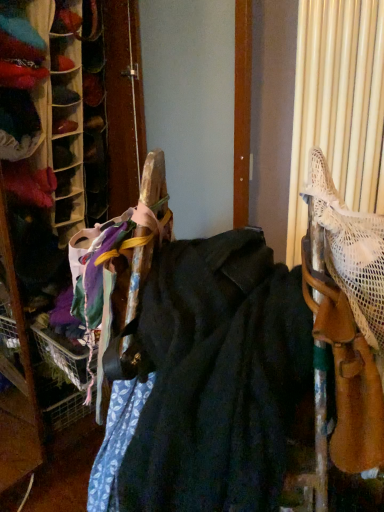
Find the location of a particular element. velvet-like fabric at center, which ranks as the 1th wide in left-to-right order is located at coordinates (218, 378).

What is the approximate width of velvet-like fabric at center, which ranks as the 1th wide in left-to-right order?

velvet-like fabric at center, which ranks as the 1th wide in left-to-right order, is 19.77 inches wide.

What do you see at coordinates (218, 378) in the screenshot? I see `velvet-like fabric at center, the 2th wide positioned from the right` at bounding box center [218, 378].

What do you see at coordinates (350, 250) in the screenshot?
I see `white mesh bag at right, the 2th wide in the left-to-right sequence` at bounding box center [350, 250].

Locate an element on the screen. white mesh bag at right, the first wide from the right is located at coordinates (350, 250).

What are the coordinates of `velvet-like fabric at center, which ranks as the 1th wide in left-to-right order` in the screenshot? It's located at (218, 378).

Considering the relative positions of velvet-like fabric at center, which ranks as the 1th wide in left-to-right order, and white mesh bag at right, the 2th wide in the left-to-right sequence, in the image provided, is velvet-like fabric at center, which ranks as the 1th wide in left-to-right order, to the right of white mesh bag at right, the 2th wide in the left-to-right sequence, from the viewer's perspective?

No.

Is velvet-like fabric at center, which ranks as the 1th wide in left-to-right order, further to camera compared to white mesh bag at right, the first wide from the right?

No, it is in front of white mesh bag at right, the first wide from the right.

Is point (173, 404) positioned behind point (383, 255)?

No, (173, 404) is in front of (383, 255).

From the image's perspective, which is above, velvet-like fabric at center, the 2th wide positioned from the right, or white mesh bag at right, the first wide from the right?

white mesh bag at right, the first wide from the right, from the image's perspective.

From a real-world perspective, is velvet-like fabric at center, the 2th wide positioned from the right, located higher than white mesh bag at right, the 2th wide in the left-to-right sequence?

Actually, velvet-like fabric at center, the 2th wide positioned from the right, is physically below white mesh bag at right, the 2th wide in the left-to-right sequence, in the real world.

Which object is thinner, velvet-like fabric at center, which ranks as the 1th wide in left-to-right order, or white mesh bag at right, the first wide from the right?

Thinner between the two is white mesh bag at right, the first wide from the right.

Who is taller, velvet-like fabric at center, the 2th wide positioned from the right, or white mesh bag at right, the 2th wide in the left-to-right sequence?

Standing taller between the two is velvet-like fabric at center, the 2th wide positioned from the right.

Between velvet-like fabric at center, which ranks as the 1th wide in left-to-right order, and white mesh bag at right, the first wide from the right, which one has smaller size?

white mesh bag at right, the first wide from the right, is smaller.

Is velvet-like fabric at center, which ranks as the 1th wide in left-to-right order, not within white mesh bag at right, the first wide from the right?

Yes, velvet-like fabric at center, which ranks as the 1th wide in left-to-right order, is not within white mesh bag at right, the first wide from the right.

Could you tell me if velvet-like fabric at center, which ranks as the 1th wide in left-to-right order, is facing white mesh bag at right, the first wide from the right?

No, velvet-like fabric at center, which ranks as the 1th wide in left-to-right order, is not facing towards white mesh bag at right, the first wide from the right.

How many degrees apart are the facing directions of velvet-like fabric at center, which ranks as the 1th wide in left-to-right order, and white mesh bag at right, the 2th wide in the left-to-right sequence?

24.3 degrees separate the facing orientations of velvet-like fabric at center, which ranks as the 1th wide in left-to-right order, and white mesh bag at right, the 2th wide in the left-to-right sequence.

Identify the location of wide located behind the velvet-like fabric at center, the 2th wide positioned from the right. The image size is (384, 512). (350, 250).

Is white mesh bag at right, the 2th wide in the left-to-right sequence, to the left or to the right of velvet-like fabric at center, which ranks as the 1th wide in left-to-right order, in the image?

white mesh bag at right, the 2th wide in the left-to-right sequence, is positioned on velvet-like fabric at center, which ranks as the 1th wide in left-to-right order,'s right side.

Is white mesh bag at right, the first wide from the right, closer to the viewer compared to velvet-like fabric at center, which ranks as the 1th wide in left-to-right order?

No, it is behind velvet-like fabric at center, which ranks as the 1th wide in left-to-right order.

Which is farther, (338, 253) or (189, 324)?

Point (189, 324)

From the image's perspective, is white mesh bag at right, the first wide from the right, above velvet-like fabric at center, which ranks as the 1th wide in left-to-right order?

Correct, white mesh bag at right, the first wide from the right, appears higher than velvet-like fabric at center, which ranks as the 1th wide in left-to-right order, in the image.

From a real-world perspective, is white mesh bag at right, the first wide from the right, positioned under velvet-like fabric at center, the 2th wide positioned from the right, based on gravity?

No.

From the picture: Considering the relative sizes of white mesh bag at right, the first wide from the right, and velvet-like fabric at center, which ranks as the 1th wide in left-to-right order, in the image provided, is white mesh bag at right, the first wide from the right, wider than velvet-like fabric at center, which ranks as the 1th wide in left-to-right order,?

Incorrect, the width of white mesh bag at right, the first wide from the right, does not surpass that of velvet-like fabric at center, which ranks as the 1th wide in left-to-right order.

Considering the sizes of objects white mesh bag at right, the first wide from the right, and velvet-like fabric at center, the 2th wide positioned from the right, in the image provided, who is shorter, white mesh bag at right, the first wide from the right, or velvet-like fabric at center, the 2th wide positioned from the right,?

Standing shorter between the two is white mesh bag at right, the first wide from the right.

Is white mesh bag at right, the 2th wide in the left-to-right sequence, bigger or smaller than velvet-like fabric at center, the 2th wide positioned from the right?

In the image, white mesh bag at right, the 2th wide in the left-to-right sequence, appears to be smaller than velvet-like fabric at center, the 2th wide positioned from the right.

Is white mesh bag at right, the 2th wide in the left-to-right sequence, surrounding velvet-like fabric at center, which ranks as the 1th wide in left-to-right order?

No.

Is white mesh bag at right, the first wide from the right, next to velvet-like fabric at center, the 2th wide positioned from the right?

They are not placed beside each other.

Is white mesh bag at right, the first wide from the right, aimed at velvet-like fabric at center, which ranks as the 1th wide in left-to-right order?

Yes, white mesh bag at right, the first wide from the right, is aimed at velvet-like fabric at center, which ranks as the 1th wide in left-to-right order.

How far apart are white mesh bag at right, the 2th wide in the left-to-right sequence, and velvet-like fabric at center, the 2th wide positioned from the right?

The distance of white mesh bag at right, the 2th wide in the left-to-right sequence, from velvet-like fabric at center, the 2th wide positioned from the right, is 9.14 inches.

At what (x,y) coordinates should I click in order to perform the action: click on wide on the left of white mesh bag at right, the 2th wide in the left-to-right sequence. Please return your answer as a coordinate pair (x, y). This screenshot has height=512, width=384. Looking at the image, I should click on (218, 378).

Where is `wide behind the velvet-like fabric at center, which ranks as the 1th wide in left-to-right order`? This screenshot has height=512, width=384. wide behind the velvet-like fabric at center, which ranks as the 1th wide in left-to-right order is located at coordinates (350, 250).

The height and width of the screenshot is (512, 384). I want to click on wide located in front of the white mesh bag at right, the first wide from the right, so coord(218,378).